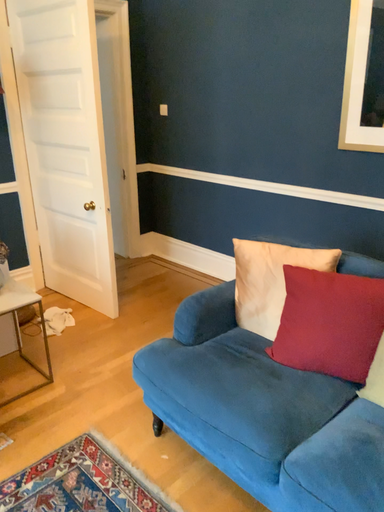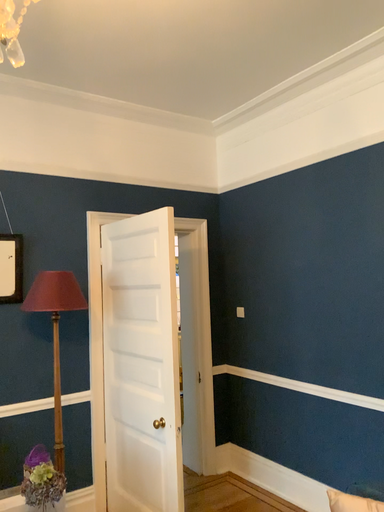
Question: Which way did the camera rotate in the video?

Choices:
 (A) rotated upward
 (B) rotated downward

Answer: (A)